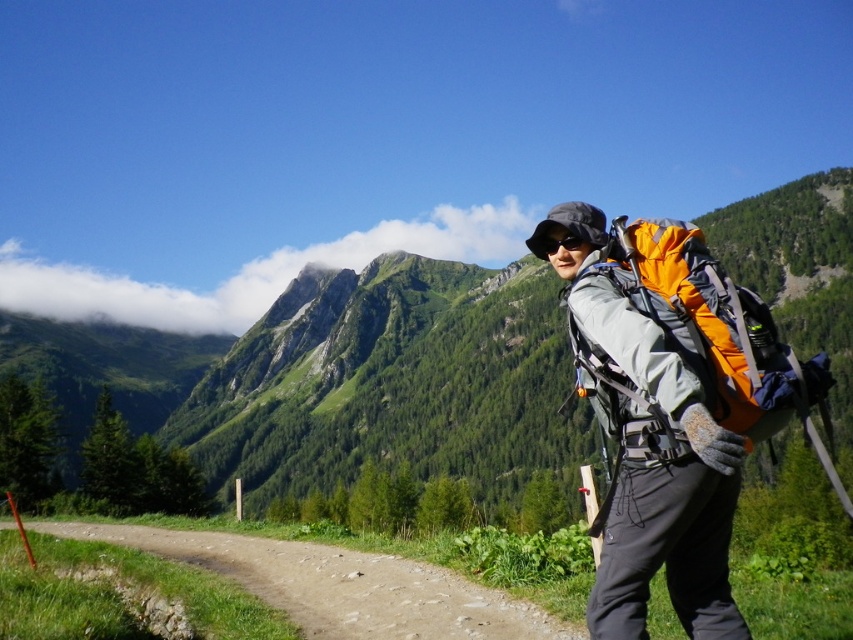
Question: Which of the following is the farthest from the observer?

Choices:
 (A) matte gray jacket at center
 (B) black matte sunglasses at center
 (C) dirt/gravel path at lower left
 (D) orange fabric backpack at right

Answer: (B)

Question: Does matte gray jacket at center appear on the right side of dirt/gravel path at lower left?

Choices:
 (A) no
 (B) yes

Answer: (B)

Question: Can you confirm if green grassy mountain at center is bigger than orange fabric backpack at right?

Choices:
 (A) no
 (B) yes

Answer: (B)

Question: Estimate the real-world distances between objects in this image. Which object is farther from the dirt/gravel path at lower left?

Choices:
 (A) black matte sunglasses at center
 (B) matte gray jacket at center

Answer: (A)

Question: Which point is closer to the camera taking this photo?

Choices:
 (A) (799, 388)
 (B) (230, 568)
 (C) (848, 284)

Answer: (A)

Question: Does dirt/gravel path at lower left appear over black matte sunglasses at center?

Choices:
 (A) yes
 (B) no

Answer: (B)